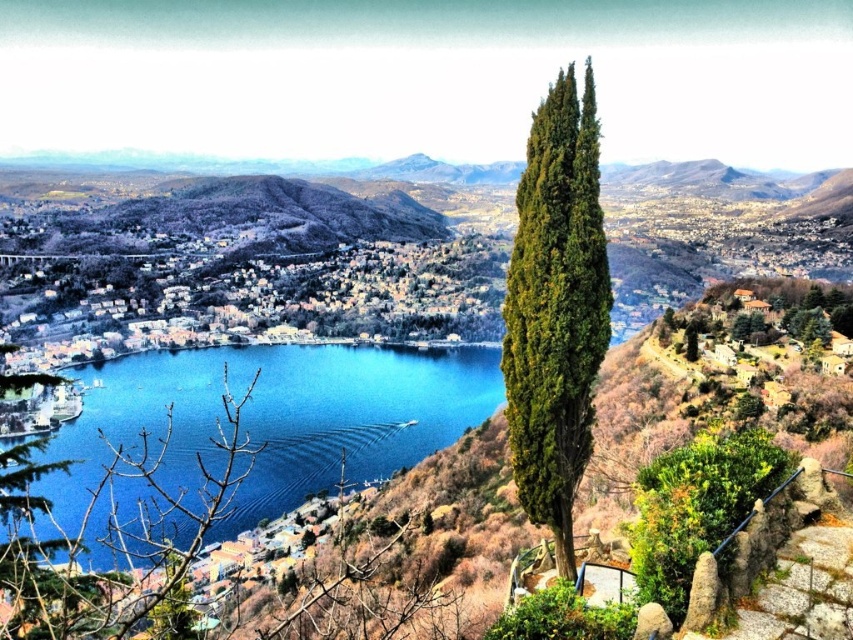
Measure the distance between green textured cypress at right and green matte tree at lower left.

The distance of green textured cypress at right from green matte tree at lower left is 175.19 feet.

Does point (509, 404) come farther from viewer compared to point (117, 616)?

Yes, it is.

The height and width of the screenshot is (640, 853). I want to click on green textured cypress at right, so pyautogui.click(x=555, y=308).

Is blue water at center to the right of green textured cypress at right from the viewer's perspective?

Incorrect, blue water at center is not on the right side of green textured cypress at right.

The height and width of the screenshot is (640, 853). What do you see at coordinates (271, 419) in the screenshot?
I see `blue water at center` at bounding box center [271, 419].

What are the coordinates of `blue water at center` in the screenshot? It's located at (271, 419).

Is blue water at center further to the viewer compared to green matte tree at lower left?

Yes, it is behind green matte tree at lower left.

Does blue water at center appear over green matte tree at lower left?

Indeed, blue water at center is positioned over green matte tree at lower left.

Identify the location of blue water at center. (271, 419).